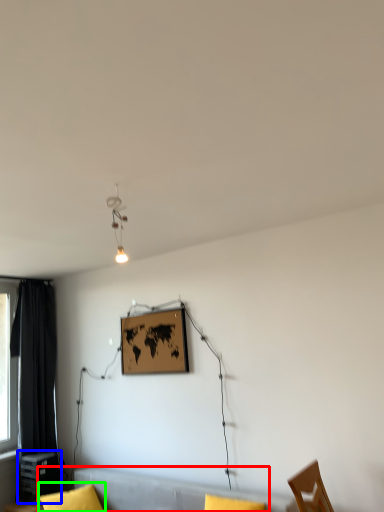
Question: Which object is the farthest from couch (highlighted by a red box)? Choose among these: table (highlighted by a blue box) or pillow (highlighted by a green box).

Choices:
 (A) table
 (B) pillow

Answer: (A)